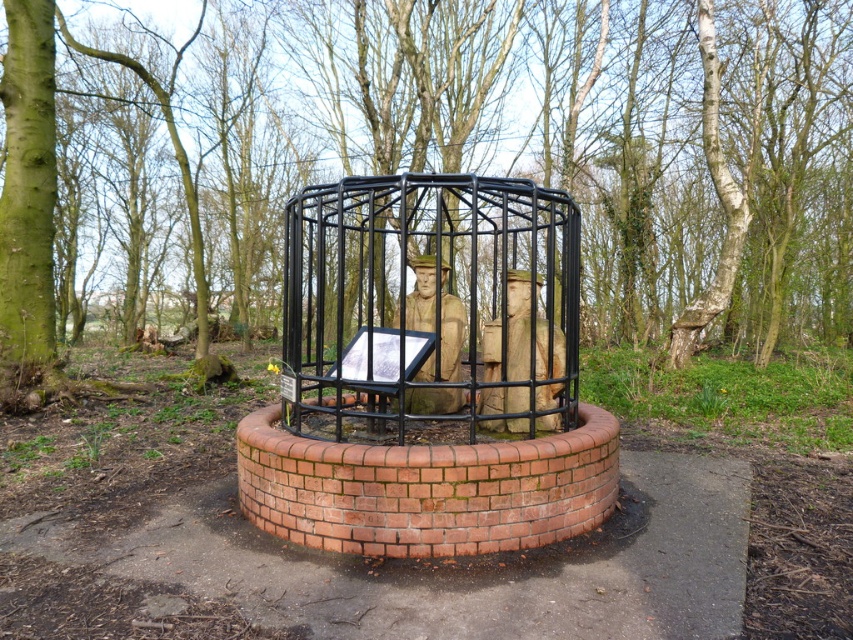
Question: Can you confirm if green bark tree at center is positioned to the right of black metal cage at center?

Choices:
 (A) no
 (B) yes

Answer: (A)

Question: In this image, where is green bark tree at center located relative to black metal cage at center?

Choices:
 (A) above
 (B) below

Answer: (A)

Question: Is green bark tree at center above black metal cage at center?

Choices:
 (A) yes
 (B) no

Answer: (A)

Question: Which of the following is the closest to the observer?

Choices:
 (A) black metal cage at center
 (B) green bark tree at center

Answer: (A)